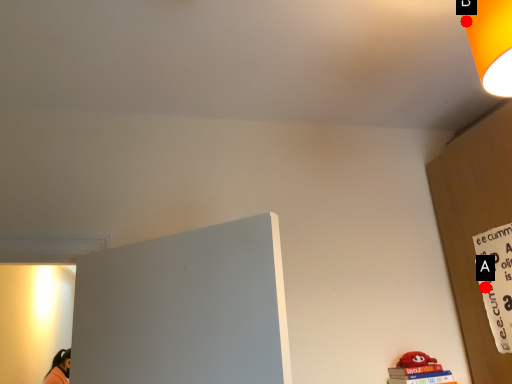
Question: Two points are circled on the image, labeled by A and B beside each circle. Which point is closer to the camera taking this photo?

Choices:
 (A) A is closer
 (B) B is closer

Answer: (B)